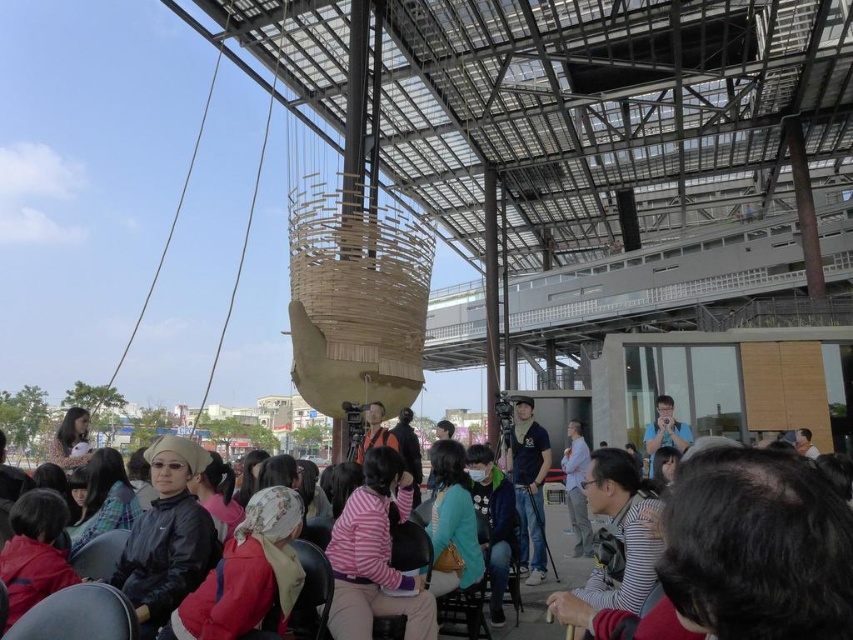
Between point (64, 620) and point (679, 451), which one is positioned behind?

The point (679, 451) is behind.

Between leather-like black chair at lower left and blue fabric shirt at center, which one appears on the left side from the viewer's perspective?

leather-like black chair at lower left is more to the left.

Is point (77, 632) closer to viewer compared to point (645, 445)?

Yes, it is.

Identify the location of leather-like black chair at lower left. The height and width of the screenshot is (640, 853). (77, 616).

Is light blue shirt at center to the left of matte black chair at lower left from the viewer's perspective?

In fact, light blue shirt at center is to the right of matte black chair at lower left.

The height and width of the screenshot is (640, 853). What do you see at coordinates (576, 486) in the screenshot? I see `light blue shirt at center` at bounding box center [576, 486].

Image resolution: width=853 pixels, height=640 pixels. What do you see at coordinates (576, 486) in the screenshot?
I see `light blue shirt at center` at bounding box center [576, 486].

You are a GUI agent. You are given a task and a screenshot of the screen. Output one action in this format:
    pyautogui.click(x=<x>, y=<y>)
    Task: Click on the light blue shirt at center
    Image resolution: width=853 pixels, height=640 pixels.
    Given the screenshot: What is the action you would take?
    pyautogui.click(x=576, y=486)

How far apart are black leather chair at center and light blue shirt at center?

black leather chair at center and light blue shirt at center are 9.00 meters apart.

Is black leather chair at center bigger than light blue shirt at center?

Yes, black leather chair at center is bigger than light blue shirt at center.

Who is more distant from viewer, (291, 612) or (585, 509)?

The point (585, 509) is more distant.

The height and width of the screenshot is (640, 853). Find the location of `black leather chair at center`. black leather chair at center is located at coordinates (311, 593).